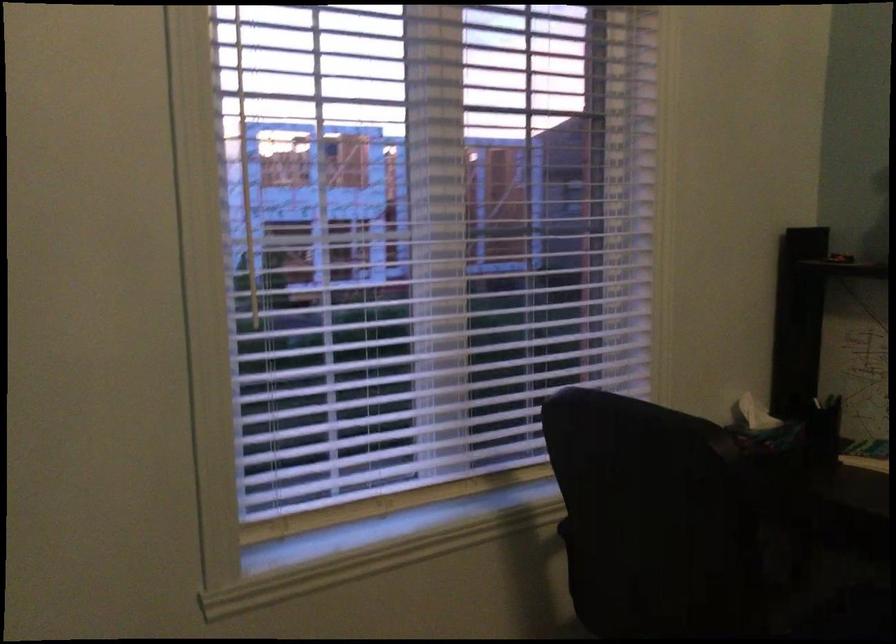
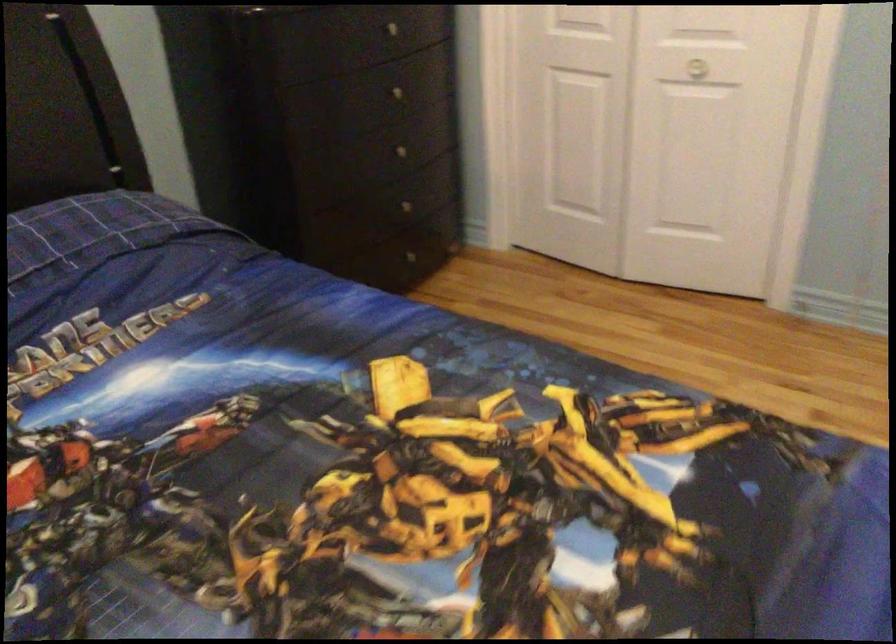
The images are taken continuously from a first-person perspective. In which direction is your viewpoint rotating?

The camera's rotation is toward right-down.